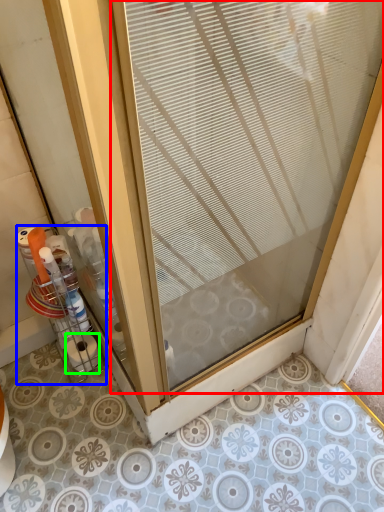
Question: Which object is the farthest from door (highlighted by a red box)? Choose among these: glass box (highlighted by a blue box) or toilet paper (highlighted by a green box).

Choices:
 (A) glass box
 (B) toilet paper

Answer: (B)